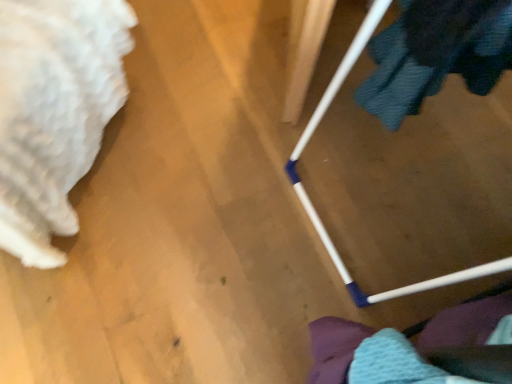
The height and width of the screenshot is (384, 512). I want to click on white plastic crutch at right, so click(314, 207).

Describe the element at coordinates (314, 207) in the screenshot. This screenshot has height=384, width=512. I see `white plastic crutch at right` at that location.

Find the location of a particular element. Image resolution: width=512 pixels, height=384 pixels. white plastic crutch at right is located at coordinates (314, 207).